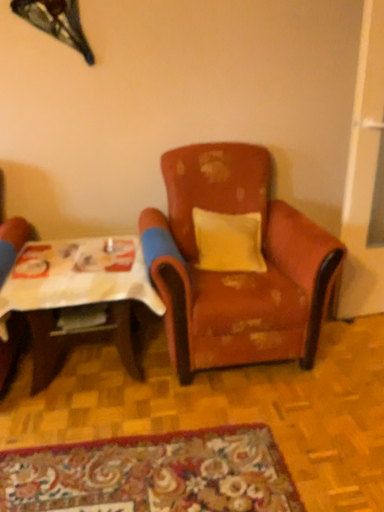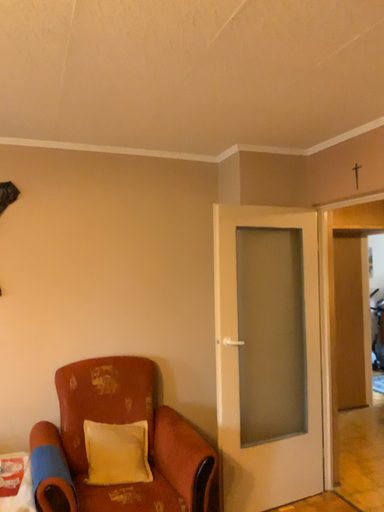
Question: How did the camera likely rotate when shooting the video?

Choices:
 (A) rotated right
 (B) rotated left

Answer: (A)